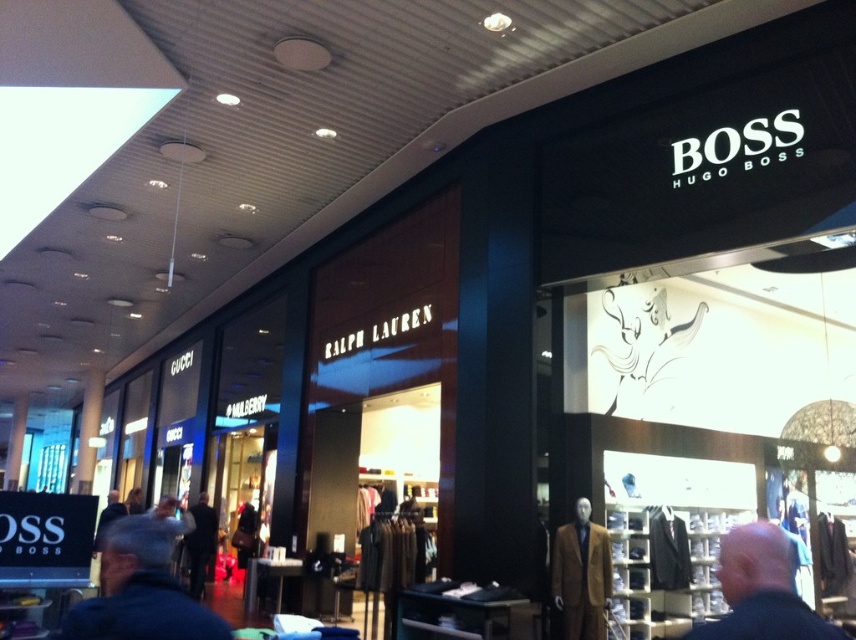
You are a customer in the mall and want to know if you can carry both the dark blue jacket at center and the dark brown leather jacket at lower left in one hand without dropping either. The average human arm span is 6 feet. Can you do it?

The dark blue jacket at center and the dark brown leather jacket at lower left are 31.68 feet apart, which is much wider than the average human arm span of 6 feet. Therefore, you cannot carry both jackets in one hand without dropping them.

You are a customer looking to purchase a jacket for a casual evening out. The store has the dark blue jacket at center and the dark brown leather jacket at lower left. Which jacket takes up more space in the store display?

The dark brown leather jacket at lower left takes up more space in the store display than the dark blue jacket at center.

You are a customer standing in front of the BOSS HUGO BOSS store entrance. You see the brown wool suit at center and the dark brown leather jacket at lower left. Which item is positioned closer to you?

The brown wool suit at center is closer to the viewer than the dark brown leather jacket at lower left.